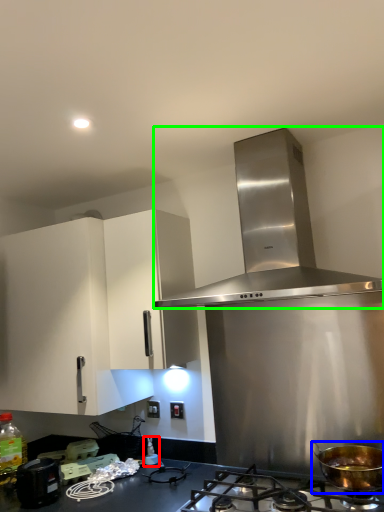
Question: Which object is the farthest from bottle (highlighted by a red box)? Choose among these: kitchen appliance (highlighted by a blue box) or home appliance (highlighted by a green box).

Choices:
 (A) kitchen appliance
 (B) home appliance

Answer: (B)